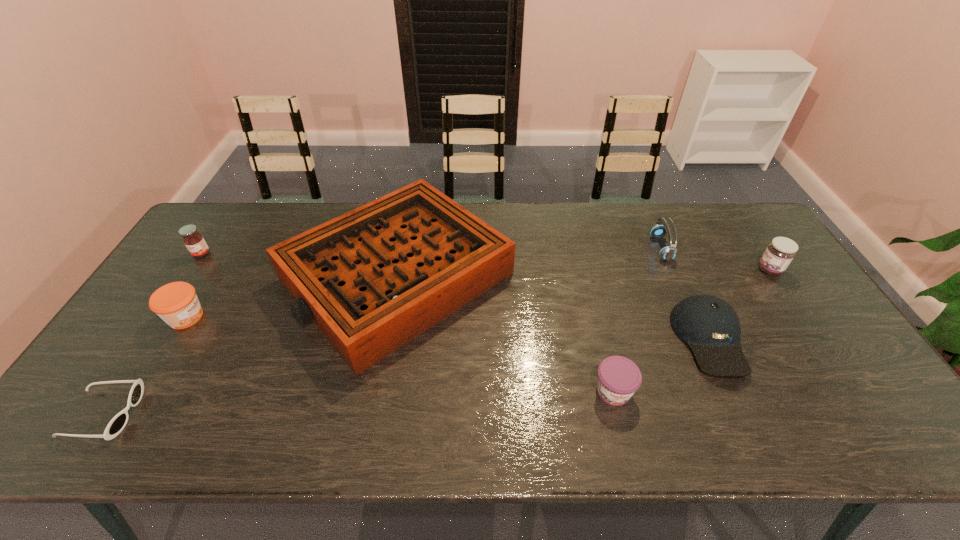
The width and height of the screenshot is (960, 540). In the image, there is a desktop. In order to click on vacant space at the left edge in this screenshot , I will do click(x=204, y=289).

Identify the location of vacant space at the right edge of the desktop. (760, 314).

Locate an element on the screen. This screenshot has width=960, height=540. vacant region at the near right corner of the desktop is located at coordinates (872, 421).

What are the coordinates of `blank region between the third farthest jam and the fourth object from left to right` in the screenshot? It's located at (292, 296).

Find the location of a particular element. This screenshot has width=960, height=540. unoccupied area between the sunglasses and the fourth object from right to left is located at coordinates (358, 402).

The height and width of the screenshot is (540, 960). I want to click on free spot between the shortest object and the third jam from left to right, so click(358, 402).

Where is `vacant space that is in between the baseball cap and the third jam from left to right`? The width and height of the screenshot is (960, 540). vacant space that is in between the baseball cap and the third jam from left to right is located at coordinates (661, 366).

You are a GUI agent. You are given a task and a screenshot of the screen. Output one action in this format:
    pyautogui.click(x=<x>, y=<y>)
    Task: Click on the free point between the gameboard and the second nearest jam
    
    Given the screenshot: What is the action you would take?
    pyautogui.click(x=292, y=296)

You are a GUI agent. You are given a task and a screenshot of the screen. Output one action in this format:
    pyautogui.click(x=<x>, y=<y>)
    Task: Click on the vacant area that lies between the baseball cap and the fifth object from right to left
    
    Given the screenshot: What is the action you would take?
    pyautogui.click(x=553, y=308)

Identify which object is the sixth closest to the fourth object from left to right. Please provide its 2D coordinates. Your answer should be formatted as a tuple, i.e. [(x, y)], where the tuple contains the x and y coordinates of a point satisfying the conditions above.

[(668, 253)]